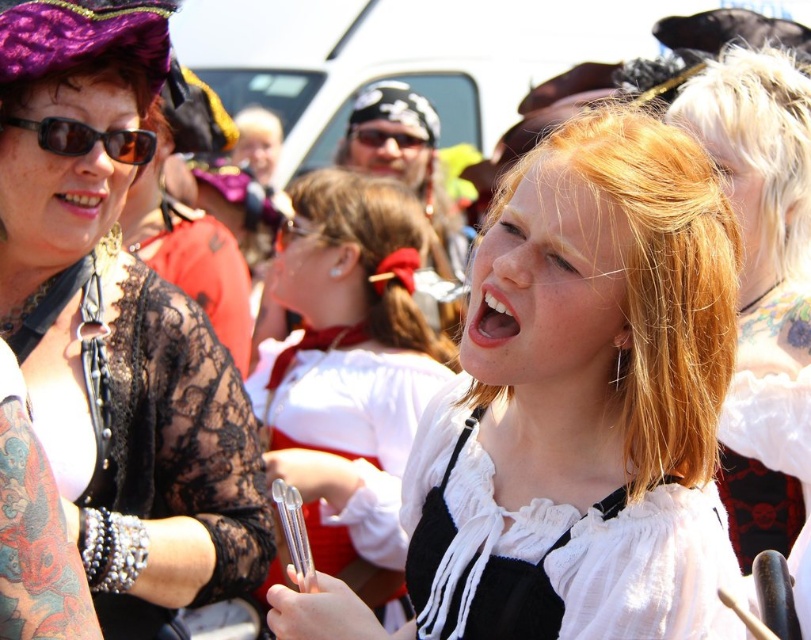
Who is taller, lace fabric blouse at upper left or matte black sunglasses at upper left?

With more height is lace fabric blouse at upper left.

Does lace fabric blouse at upper left have a lesser height compared to matte black sunglasses at upper left?

Incorrect, lace fabric blouse at upper left's height does not fall short of matte black sunglasses at upper left's.

Between point (122, 548) and point (147, 140), which one is positioned behind?

The point (147, 140) is behind.

This screenshot has height=640, width=811. Find the location of `lace fabric blouse at upper left`. lace fabric blouse at upper left is located at coordinates 117,324.

Does white cotton blouse at center appear on the right side of white glossy teeth at center?

Yes, white cotton blouse at center is to the right of white glossy teeth at center.

What do you see at coordinates (556, 550) in the screenshot? The height and width of the screenshot is (640, 811). I see `white cotton blouse at center` at bounding box center [556, 550].

Is point (440, 477) farther from camera compared to point (116, 211)?

Yes.

Where is `white cotton blouse at center`? This screenshot has height=640, width=811. white cotton blouse at center is located at coordinates (556, 550).

Measure the distance from pink glossy lips at center to black plastic goggles at center.

pink glossy lips at center is 9.15 meters away from black plastic goggles at center.

Can you confirm if pink glossy lips at center is smaller than black plastic goggles at center?

Correct, pink glossy lips at center occupies less space than black plastic goggles at center.

This screenshot has width=811, height=640. Describe the element at coordinates (490, 317) in the screenshot. I see `pink glossy lips at center` at that location.

The image size is (811, 640). Find the location of `pink glossy lips at center`. pink glossy lips at center is located at coordinates (490, 317).